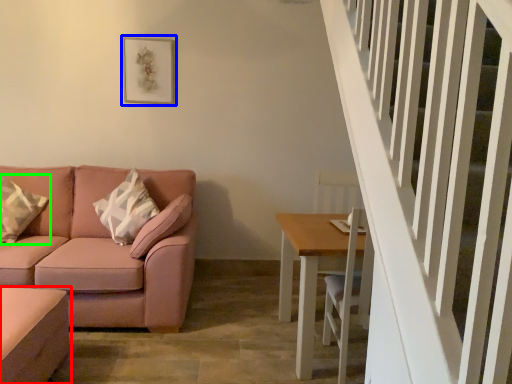
Question: Estimate the real-world distances between objects in this image. Which object is closer to table (highlighted by a red box), picture frame (highlighted by a blue box) or pillow (highlighted by a green box)?

Choices:
 (A) picture frame
 (B) pillow

Answer: (B)